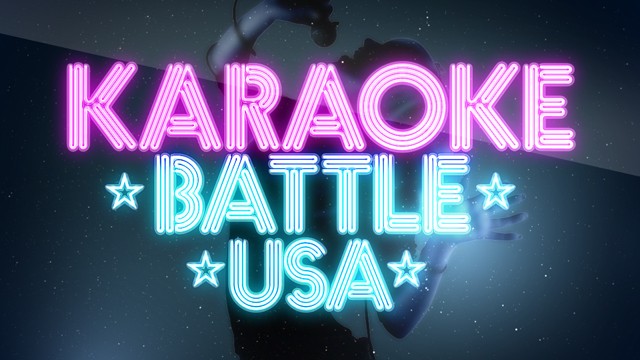
You are a GUI agent. You are given a task and a screenshot of the screen. Output one action in this format:
    pyautogui.click(x=<x>, y=<y>)
    Task: Click on the pink neon letters
    The image size is (640, 360).
    Given the screenshot: What is the action you would take?
    pyautogui.click(x=93, y=107), pyautogui.click(x=170, y=99), pyautogui.click(x=246, y=99), pyautogui.click(x=308, y=108), pyautogui.click(x=372, y=100), pyautogui.click(x=459, y=106), pyautogui.click(x=547, y=105)